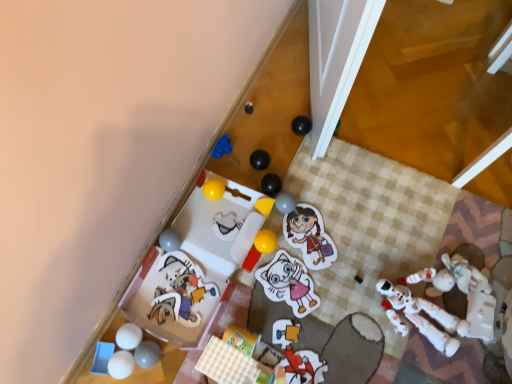
The width and height of the screenshot is (512, 384). I want to click on vacant region to the left of white plastic toy at lower right, marked as the first toy in a right-to-left arrangement, so click(x=345, y=301).